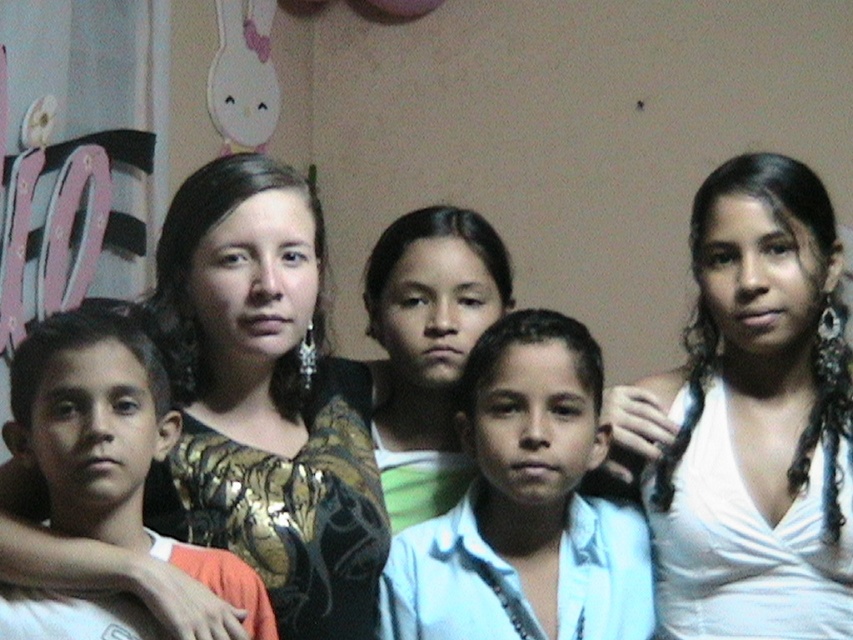
Which of these two, light blue shirt at center or matte green shirt at center, stands taller?

matte green shirt at center is taller.

Where is `light blue shirt at center`? This screenshot has width=853, height=640. light blue shirt at center is located at coordinates (525, 506).

Where is `light blue shirt at center`? The width and height of the screenshot is (853, 640). light blue shirt at center is located at coordinates (525, 506).

Is gold sequined blouse at center to the right of white satin dress at upper right from the viewer's perspective?

Incorrect, gold sequined blouse at center is not on the right side of white satin dress at upper right.

Is point (358, 520) farther from viewer compared to point (660, 500)?

No.

Does point (167, 211) lie behind point (796, 513)?

No, it is not.

Find the location of a particular element. gold sequined blouse at center is located at coordinates (267, 401).

Does white matte shirt at left have a lesser height compared to matte green shirt at center?

Indeed, white matte shirt at left has a lesser height compared to matte green shirt at center.

Which of these two, white matte shirt at left or matte green shirt at center, stands shorter?

white matte shirt at left is shorter.

Where is `white matte shirt at left`? The height and width of the screenshot is (640, 853). white matte shirt at left is located at coordinates (109, 444).